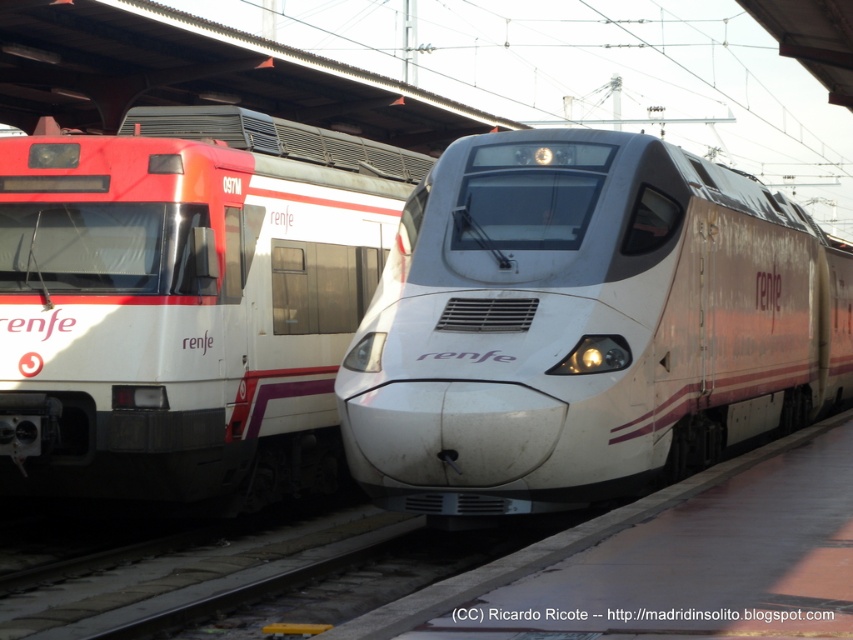
Who is higher up, white glossy train at center or white glossy train at left?

Positioned higher is white glossy train at left.

Does point (685, 156) lie in front of point (21, 432)?

No.

This screenshot has width=853, height=640. I want to click on white glossy train at center, so click(x=585, y=324).